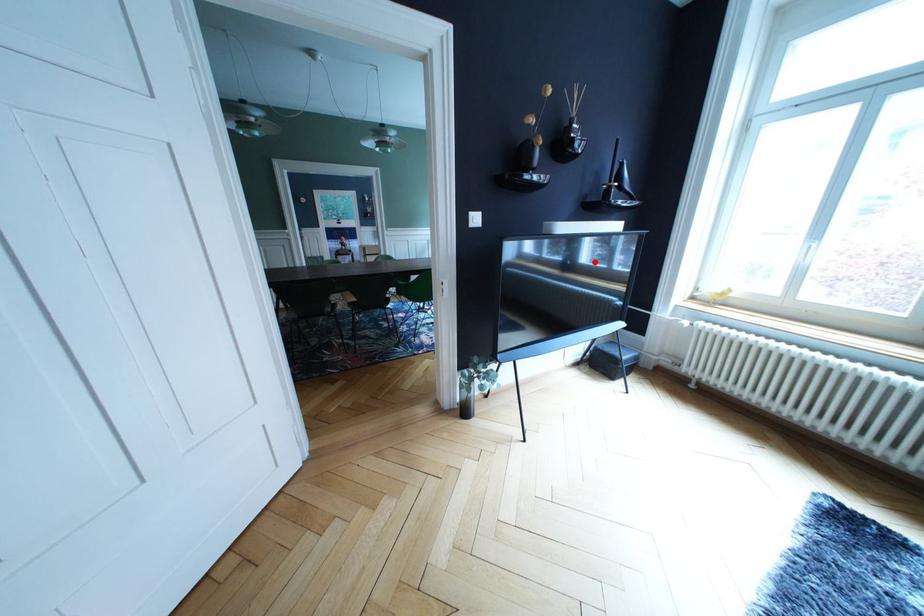
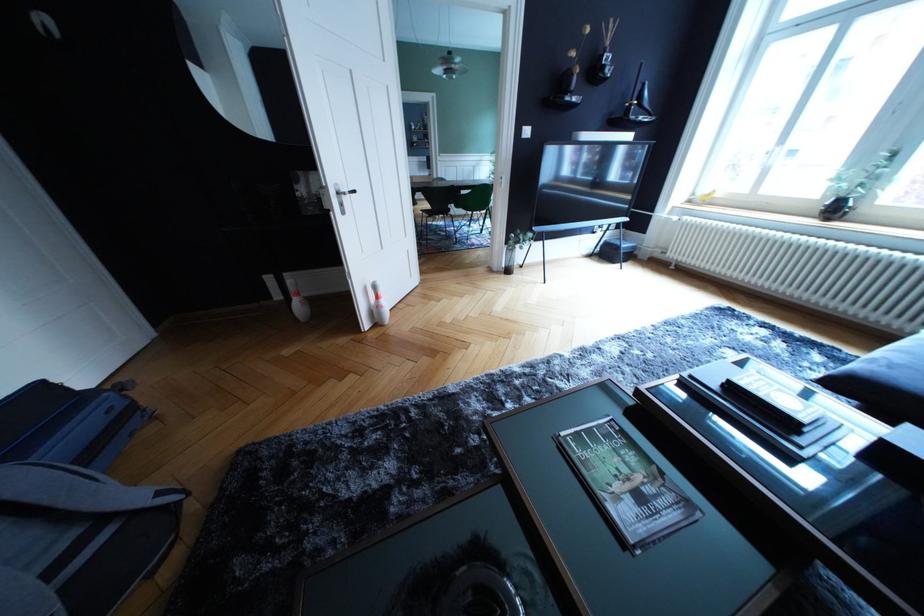
In the second image, find the point that corresponds to the highlighted location in the first image.

(622, 180)